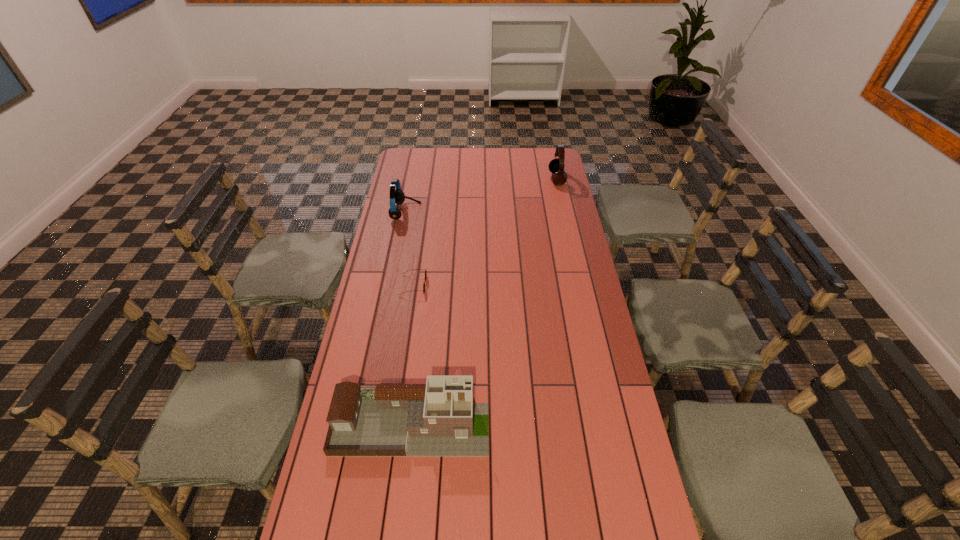
Identify the location of free region located with the microphone attached to the side of the second farthest object. This screenshot has width=960, height=540. (488, 212).

Find the location of a particular element. vacant space positioned at the main entrance of the nearest object is located at coordinates (581, 424).

I want to click on free space located 0.350m on the front-facing side of the third farthest object, so [517, 285].

Where is `object that is at the far edge`? The width and height of the screenshot is (960, 540). object that is at the far edge is located at coordinates (556, 166).

You are a GUI agent. You are given a task and a screenshot of the screen. Output one action in this format:
    pyautogui.click(x=<x>, y=<y>)
    Task: Click on the headset that is at the left edge
    The height and width of the screenshot is (540, 960).
    Given the screenshot: What is the action you would take?
    pyautogui.click(x=397, y=196)

This screenshot has width=960, height=540. Find the location of `dollhouse that is at the left edge`. dollhouse that is at the left edge is located at coordinates (438, 419).

Locate an element on the screen. This screenshot has width=960, height=540. sunglasses that is at the left edge is located at coordinates (425, 269).

Where is `object situated at the right edge`? The height and width of the screenshot is (540, 960). object situated at the right edge is located at coordinates (556, 166).

Locate an element on the screen. The height and width of the screenshot is (540, 960). object located at the far right corner is located at coordinates (556, 166).

Find the location of a particular element. vacant space at the far edge is located at coordinates (431, 167).